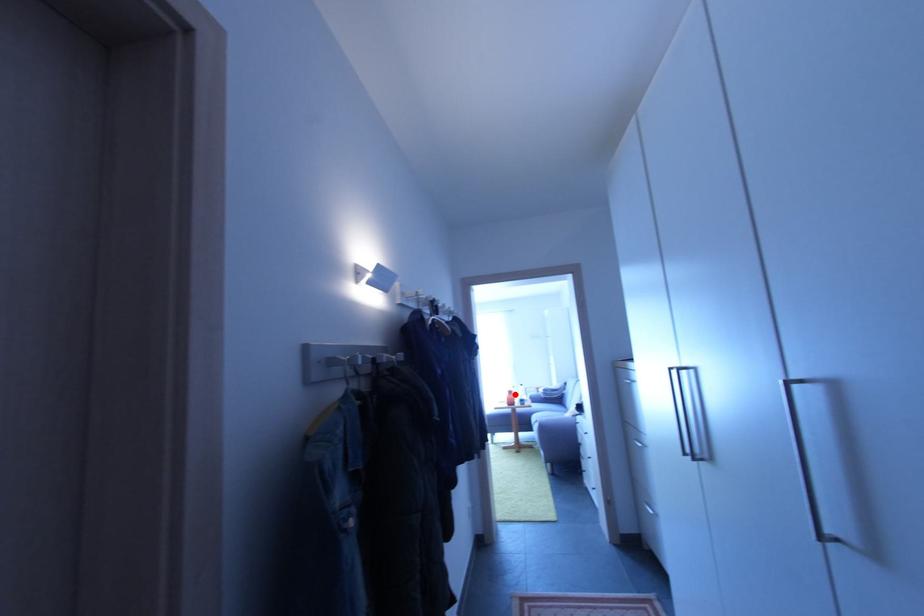
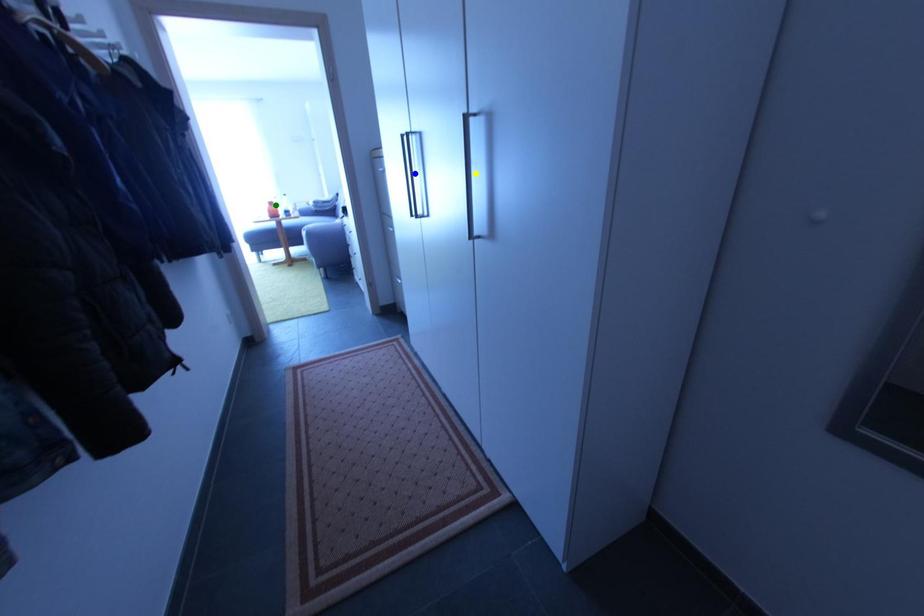
Question: I am providing you with two images of the same scene from different viewpoints. A red point is marked on the first image. You are given multiple points on the second image. In image 2, which mark is for the same physical point as the one in image 1?

Choices:
 (A) blue point
 (B) yellow point
 (C) green point

Answer: (C)